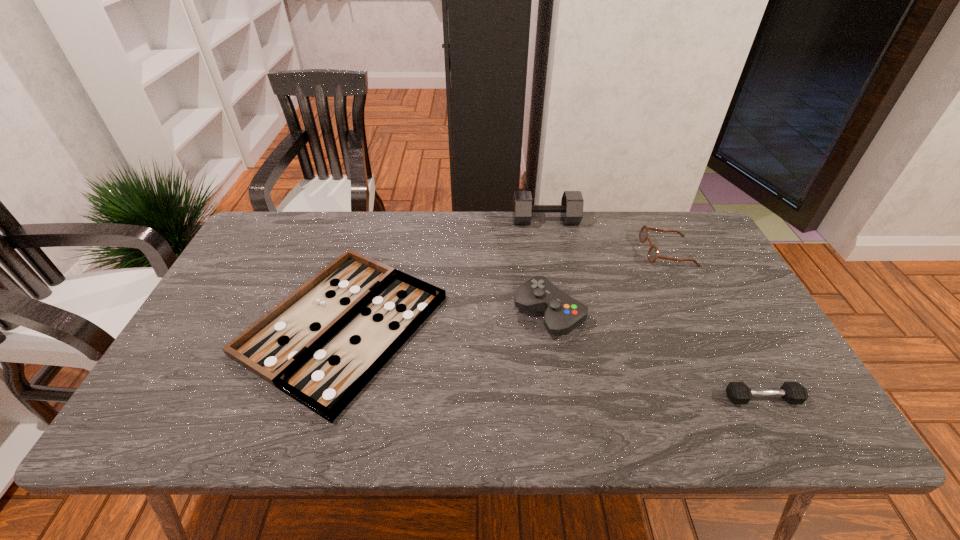
This screenshot has width=960, height=540. What are the coordinates of `blank area located 0.150m on the front-facing side of the third tallest object` in the screenshot? It's located at (595, 252).

Locate an element on the screen. This screenshot has width=960, height=540. vacant area situated on the front-facing side of the third tallest object is located at coordinates (595, 252).

Image resolution: width=960 pixels, height=540 pixels. Identify the location of vacant region located on the front-facing side of the third tallest object. (527, 252).

The height and width of the screenshot is (540, 960). Identify the location of vacant space situated on the left of the right dumbbell. (583, 399).

I want to click on vacant space located 0.060m on the right of the leftmost object, so click(x=467, y=325).

At what (x,y) coordinates should I click in order to perform the action: click on dumbbell located in the far edge section of the desktop. Please return your answer as a coordinate pair (x, y). The image size is (960, 540). Looking at the image, I should click on (571, 208).

I want to click on spectacles at the far edge, so click(x=652, y=255).

Locate an element on the screen. The height and width of the screenshot is (540, 960). gameboard located in the far edge section of the desktop is located at coordinates (321, 345).

Identify the location of dumbbell present at the near edge. (737, 392).

Locate an element on the screen. This screenshot has height=540, width=960. gameboard that is at the near edge is located at coordinates (321, 345).